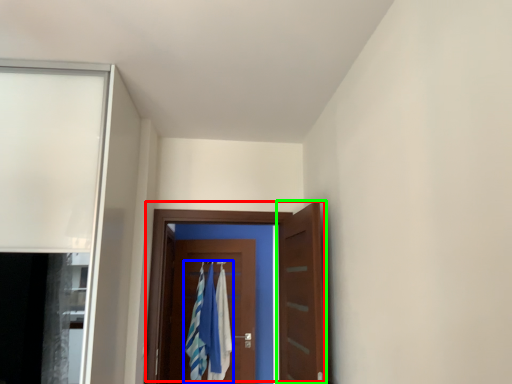
Question: Considering the real-world distances, which object is farthest from door (highlighted by a red box)? laundry (highlighted by a blue box) or door (highlighted by a green box)?

Choices:
 (A) laundry
 (B) door

Answer: (A)